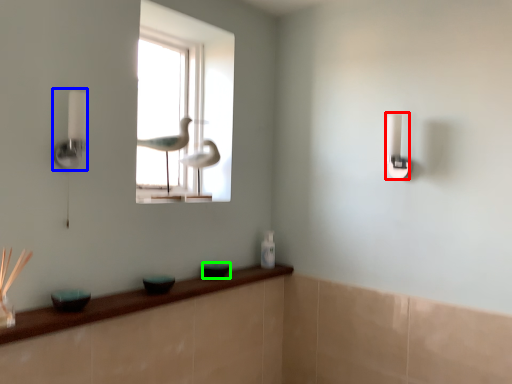
Question: Which object is positioned farthest from light switch (highlighted by a red box)? Select from lamp (highlighted by a blue box) and glass bowl (highlighted by a green box).

Choices:
 (A) lamp
 (B) glass bowl

Answer: (A)